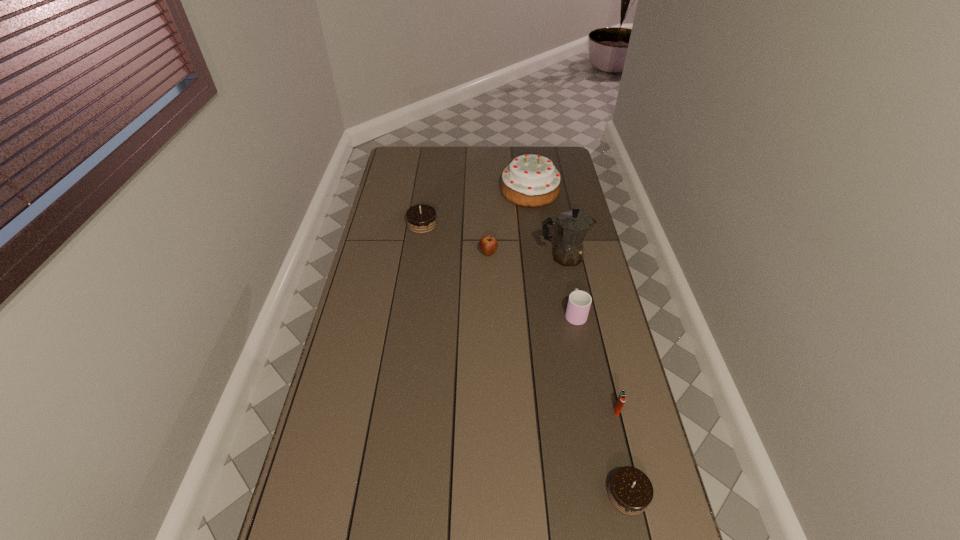
This screenshot has height=540, width=960. Identify the location of chocolate cake positioned at the right edge. [630, 491].

Where is `cake positioned at the right edge`? This screenshot has height=540, width=960. cake positioned at the right edge is located at coordinates (529, 180).

You are a GUI agent. You are given a task and a screenshot of the screen. Output one action in this format:
    pyautogui.click(x=<x>, y=<y>)
    Task: Click on the cup that is at the right edge
    The image size is (960, 540).
    Given the screenshot: What is the action you would take?
    pyautogui.click(x=579, y=302)

Locate an element on the screen. This screenshot has height=540, width=960. coffeepot present at the right edge is located at coordinates (572, 226).

Locate an element on the screen. igniter that is at the right edge is located at coordinates (621, 399).

The height and width of the screenshot is (540, 960). I want to click on object that is positioned at the near right corner, so click(630, 491).

The image size is (960, 540). In order to click on vacant space at the far edge of the desktop in this screenshot , I will do `click(437, 164)`.

In the image, there is a desktop. At what (x,y) coordinates should I click in order to perform the action: click on free space at the left edge. Please return your answer as a coordinate pair (x, y). This screenshot has width=960, height=540. Looking at the image, I should click on (353, 443).

The width and height of the screenshot is (960, 540). In the image, there is a desktop. Identify the location of vacant space at the right edge. (562, 199).

I want to click on vacant position at the far right corner of the desktop, so click(551, 154).